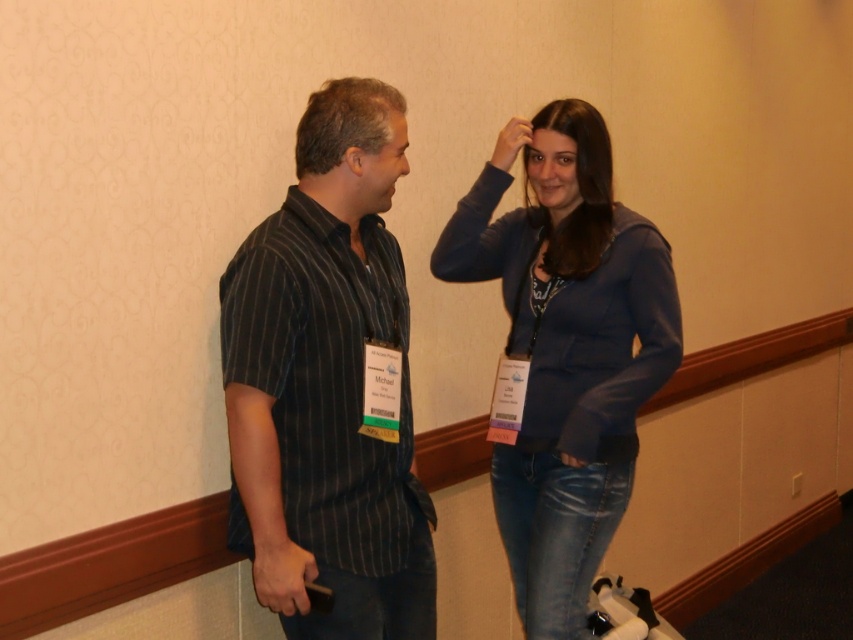
Does matte blue hoodie at center appear on the left side of matte skin forehead at upper center?

No, matte blue hoodie at center is not to the left of matte skin forehead at upper center.

Is matte blue hoodie at center to the right of matte skin forehead at upper center from the viewer's perspective?

Indeed, matte blue hoodie at center is positioned on the right side of matte skin forehead at upper center.

Who is more distant from viewer, (677, 300) or (556, 138)?

Positioned behind is point (677, 300).

At what (x,y) coordinates should I click in order to perform the action: click on matte blue hoodie at center. Please return your answer as a coordinate pair (x, y). The image size is (853, 640). Looking at the image, I should click on (567, 356).

Which of these two, striped cotton shirt at center or matte blue hoodie at center, stands shorter?

striped cotton shirt at center

Can you confirm if striped cotton shirt at center is positioned to the right of matte blue hoodie at center?

Incorrect, striped cotton shirt at center is not on the right side of matte blue hoodie at center.

At what (x,y) coordinates should I click in order to perform the action: click on striped cotton shirt at center. Please return your answer as a coordinate pair (x, y). This screenshot has width=853, height=640. Looking at the image, I should click on (328, 385).

Which is more to the left, striped cotton shirt at center or matte skin forehead at upper center?

Positioned to the left is striped cotton shirt at center.

In the scene shown: Who is more forward, (x=223, y=308) or (x=556, y=141)?

Positioned in front is point (x=223, y=308).

Image resolution: width=853 pixels, height=640 pixels. I want to click on striped cotton shirt at center, so click(328, 385).